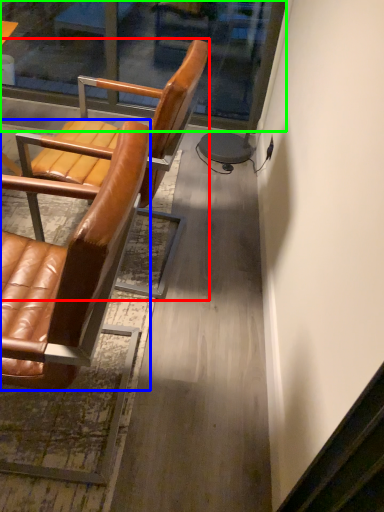
Question: Based on their relative distances, which object is farther from chair (highlighted by a red box)? Choose from chair (highlighted by a blue box) and glass door (highlighted by a green box).

Choices:
 (A) chair
 (B) glass door

Answer: (B)